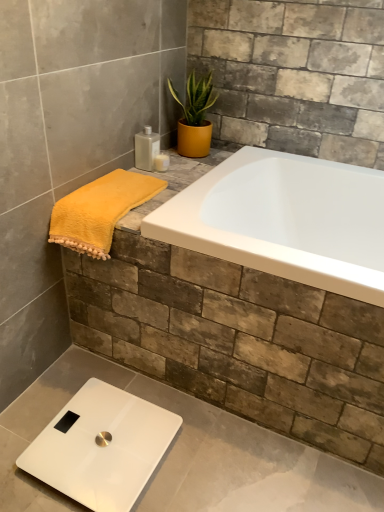
Locate an element on the screen. The width and height of the screenshot is (384, 512). free location to the right of translucent plastic soap dispenser at upper center, placed as the 1th toiletry when sorted from right to left is located at coordinates (187, 170).